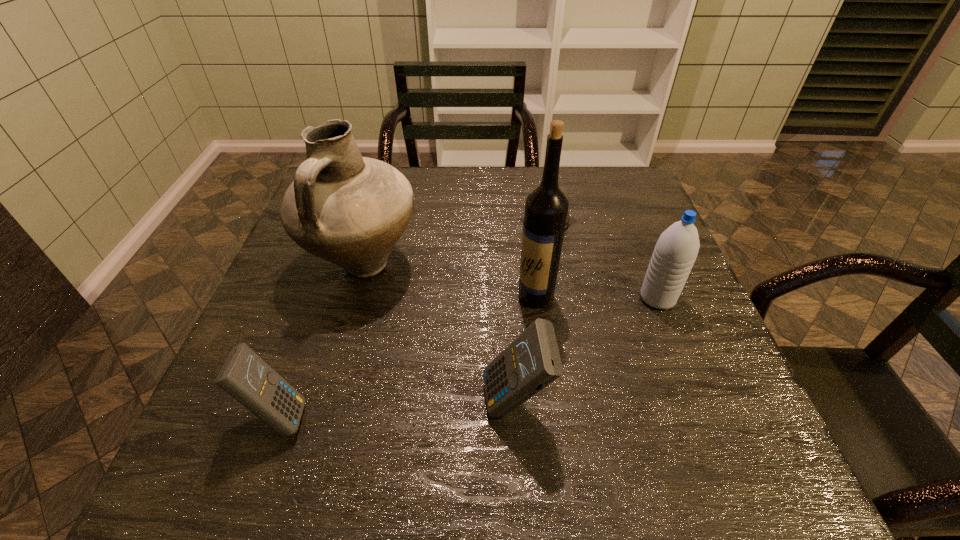
You are a GUI agent. You are given a task and a screenshot of the screen. Output one action in this format:
    pyautogui.click(x=<x>, y=<y>)
    Task: Click on the vacant point located between the fifth tallest object and the third shortest object
    
    Given the screenshot: What is the action you would take?
    pyautogui.click(x=397, y=409)

The image size is (960, 540). What are the coordinates of `vacant area that lies between the wine bottle and the rightmost object` in the screenshot? It's located at (596, 297).

The height and width of the screenshot is (540, 960). I want to click on free area in between the fifth tallest object and the shortest object, so click(x=414, y=319).

Where is `empty space between the right calculator and the rightmost object`? empty space between the right calculator and the rightmost object is located at coordinates (587, 350).

Find the location of a particular element. free space between the wine bottle and the pitcher is located at coordinates (449, 280).

Locate which object is the fourth closest to the fifth shortest object. Please provide its 2D coordinates. Your answer should be formatted as a tuple, i.e. [(x, y)], where the tuple contains the x and y coordinates of a point satisfying the conditions above.

[(568, 216)]

Select which object is the second closest to the wine bottle. Please provide its 2D coordinates. Your answer should be formatted as a tuple, i.e. [(x, y)], where the tuple contains the x and y coordinates of a point satisfying the conditions above.

[(532, 361)]

Identify the location of free point that satisfies the following two spatial constraints: 1. on the front side of the water bottle; 2. on the front-facing side of the taller calculator. The width and height of the screenshot is (960, 540). (699, 403).

Locate an element on the screen. The image size is (960, 540). free space that satisfies the following two spatial constraints: 1. on the handle side of the rightmost object; 2. on the left side of the fifth shortest object is located at coordinates (353, 298).

Locate an element on the screen. The width and height of the screenshot is (960, 540). free region that satisfies the following two spatial constraints: 1. on the handle side of the pitcher; 2. on the front-facing side of the shorter calculator is located at coordinates (321, 416).